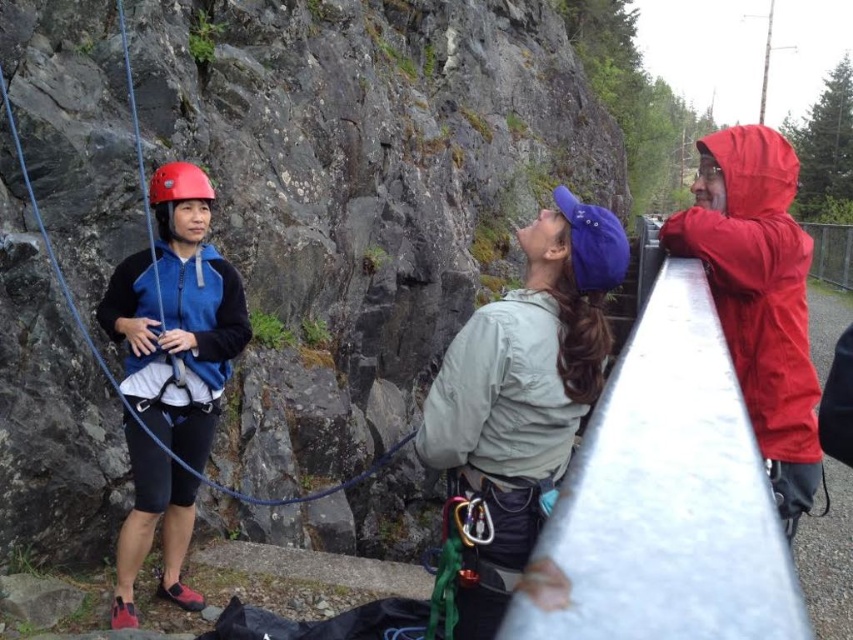
You are a clothing designer observing the climbers. Which jacket, the light gray fabric jacket at center or the matte blue jacket at left, has a smaller width?

The light gray fabric jacket at center has a smaller width than the matte blue jacket at left.

You are a photographer positioned to capture the climbers. You need to frame both the light gray fabric jacket at center and the red matte helmet at left in your shot. Which climber should you adjust your camera to focus on first to ensure both are in the frame?

You should focus on the red matte helmet at left first because the light gray fabric jacket at center is to the right of it, so adjusting from left to right ensures both are captured.

You are standing at the origin point in the scene. Where is the matte blue jacket at left located in terms of coordinates?

The matte blue jacket at left is located at coordinates point (177,316).